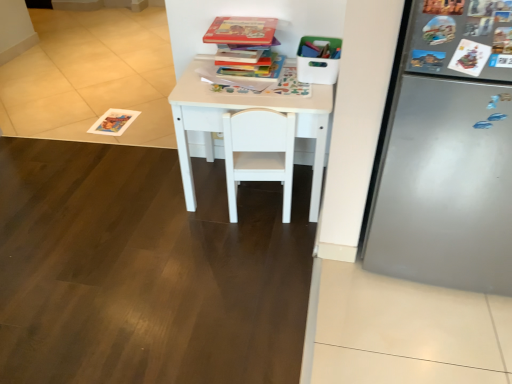
This screenshot has width=512, height=384. What are the coordinates of `free space in front of white matte table at center` in the screenshot? It's located at (249, 266).